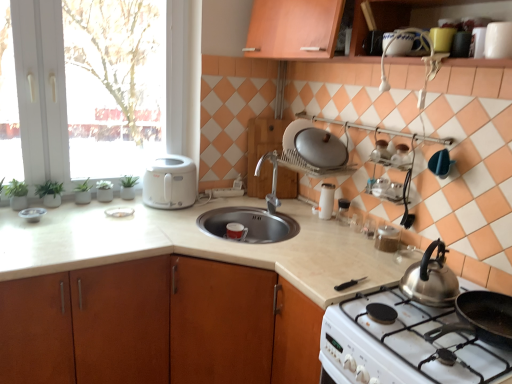
You are a GUI agent. You are given a task and a screenshot of the screen. Output one action in this format:
    pyautogui.click(x=<x>, y=<y>)
    Task: Click on the free space on the front side of white plastic toaster at left, placed as the first kitchen appliance when sorted from left to right
    
    Given the screenshot: What is the action you would take?
    pyautogui.click(x=142, y=216)